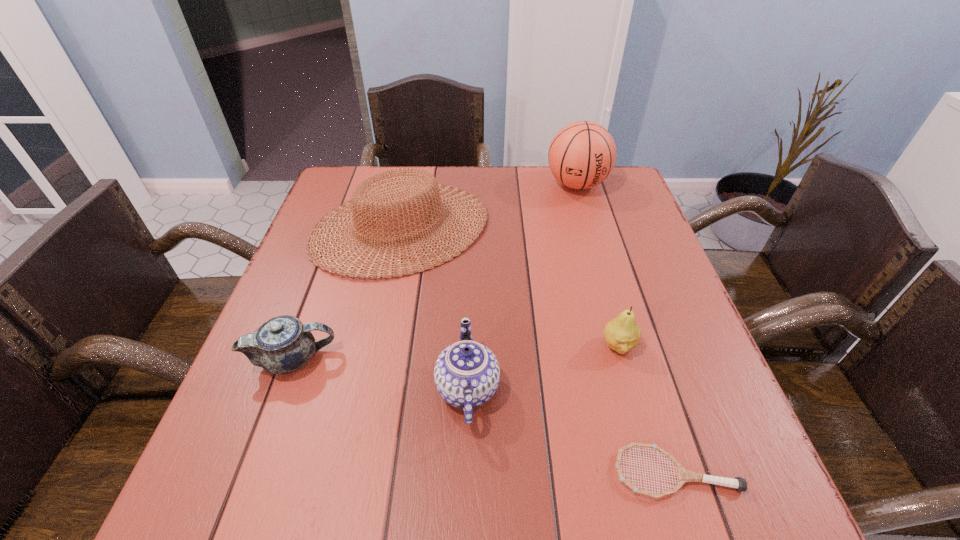
Where is `the tallest object`? This screenshot has width=960, height=540. the tallest object is located at coordinates (582, 154).

I want to click on sunhat, so click(367, 203).

This screenshot has width=960, height=540. Find the location of `the right chinaware`. the right chinaware is located at coordinates (466, 373).

This screenshot has height=540, width=960. I want to click on pear, so click(x=622, y=333).

In order to click on the left chinaware in this screenshot , I will do `click(282, 345)`.

The image size is (960, 540). I want to click on the nearest object, so (x=683, y=475).

Where is `tennis racket`? The width and height of the screenshot is (960, 540). tennis racket is located at coordinates (683, 475).

Image resolution: width=960 pixels, height=540 pixels. I want to click on blank space located on the surface of the basketball near the brand logo, so click(589, 226).

The width and height of the screenshot is (960, 540). Find the location of `vacant space located 0.050m on the right of the sunhat`. vacant space located 0.050m on the right of the sunhat is located at coordinates (507, 227).

Image resolution: width=960 pixels, height=540 pixels. In order to click on vacant space located at the spout of the right chinaware in this screenshot , I will do `click(542, 388)`.